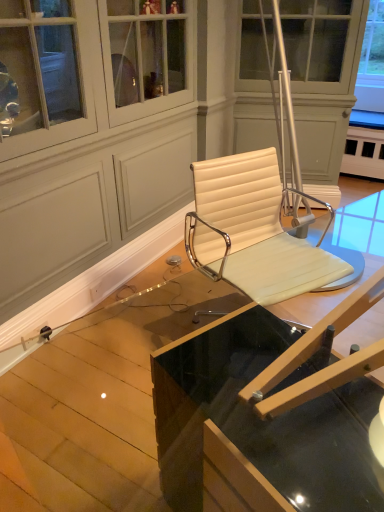
What do you see at coordinates (96, 399) in the screenshot?
I see `transparent glass table at center, the 2th table when ordered from front to back` at bounding box center [96, 399].

Describe the element at coordinates (268, 415) in the screenshot. I see `clear glass table at center, the second table viewed from the back` at that location.

This screenshot has width=384, height=512. I want to click on white leather chair at center, so click(x=251, y=231).

Is clear glass table at center, the 1th table viewed from the front, oriented towards transparent glass table at center, the 2th table when ordered from front to back?

Yes.

The height and width of the screenshot is (512, 384). I want to click on table behind the clear glass table at center, the 1th table viewed from the front, so click(96, 399).

Is clear glass table at center, the 1th table viewed from the front, to the right of transparent glass table at center, the 2th table when ordered from front to back, from the viewer's perspective?

Yes, clear glass table at center, the 1th table viewed from the front, is to the right of transparent glass table at center, the 2th table when ordered from front to back.

Which of these two, clear glass table at center, the 1th table viewed from the front, or transparent glass table at center, the 2th table when ordered from front to back, is thinner?

clear glass table at center, the 1th table viewed from the front.

From a real-world perspective, is white leather chair at center above or below transparent glass table at center, which is counted as the first table, starting from the back?

Clearly, from a real-world perspective, white leather chair at center is above transparent glass table at center, which is counted as the first table, starting from the back.

Is white leather chair at center directly adjacent to transparent glass table at center, which is counted as the first table, starting from the back?

No, white leather chair at center is not in contact with transparent glass table at center, which is counted as the first table, starting from the back.

In terms of size, does white leather chair at center appear bigger or smaller than transparent glass table at center, which is counted as the first table, starting from the back?

In the image, white leather chair at center appears to be smaller than transparent glass table at center, which is counted as the first table, starting from the back.

Does white leather chair at center touch clear glass table at center, the 1th table viewed from the front?

No, white leather chair at center is not making contact with clear glass table at center, the 1th table viewed from the front.

From the image's perspective, is white leather chair at center beneath clear glass table at center, the second table viewed from the back?

Incorrect, from the image's perspective, white leather chair at center is higher than clear glass table at center, the second table viewed from the back.

Considering the positions of point (326, 263) and point (296, 399), is point (326, 263) closer or farther from the camera than point (296, 399)?

Point (326, 263) is farther from the camera than point (296, 399).

Is the depth of white leather chair at center greater than that of clear glass table at center, the second table viewed from the back?

Yes, white leather chair at center is further from the camera.

Is transparent glass table at center, the 2th table when ordered from front to back, looking in the opposite direction of white leather chair at center?

No, white leather chair at center is not at the back of transparent glass table at center, the 2th table when ordered from front to back.

You are a GUI agent. You are given a task and a screenshot of the screen. Output one action in this format:
    pyautogui.click(x=<x>, y=<y>)
    Task: Click on the 1st table to the right of the white leather chair at center, starting your count from the anchor
    The width and height of the screenshot is (384, 512).
    Given the screenshot: What is the action you would take?
    pyautogui.click(x=96, y=399)

From the image's perspective, between transparent glass table at center, the 2th table when ordered from front to back, and white leather chair at center, who is located below?

transparent glass table at center, the 2th table when ordered from front to back, is shown below in the image.

Locate an element on the screen. table that is the 2nd object located below the white leather chair at center (from the image's perspective) is located at coordinates (268, 415).

Which of these two, clear glass table at center, the second table viewed from the back, or white leather chair at center, is smaller?

white leather chair at center is smaller.

From the image's perspective, is clear glass table at center, the second table viewed from the back, under white leather chair at center?

Indeed, from the image's perspective, clear glass table at center, the second table viewed from the back, is shown beneath white leather chair at center.

Between transparent glass table at center, which is counted as the first table, starting from the back, and clear glass table at center, the second table viewed from the back, which one has larger width?

transparent glass table at center, which is counted as the first table, starting from the back.

Does point (39, 385) come in front of point (164, 386)?

No, (39, 385) is further to viewer.

Is transparent glass table at center, the 2th table when ordered from front to back, not near clear glass table at center, the second table viewed from the back?

Actually, transparent glass table at center, the 2th table when ordered from front to back, and clear glass table at center, the second table viewed from the back, are a little close together.

Considering the relative positions of transparent glass table at center, which is counted as the first table, starting from the back, and clear glass table at center, the second table viewed from the back, in the image provided, is transparent glass table at center, which is counted as the first table, starting from the back, to the left of clear glass table at center, the second table viewed from the back, from the viewer's perspective?

Correct, you'll find transparent glass table at center, which is counted as the first table, starting from the back, to the left of clear glass table at center, the second table viewed from the back.

You are a GUI agent. You are given a task and a screenshot of the screen. Output one action in this format:
    pyautogui.click(x=<x>, y=<y>)
    Task: Click on the table below the transparent glass table at center, the 2th table when ordered from front to back (from the image's perspective)
    The image size is (384, 512).
    Given the screenshot: What is the action you would take?
    pyautogui.click(x=268, y=415)

Find the location of `the 2nd table directly beneath the white leather chair at center (from a real-world perspective)`. the 2nd table directly beneath the white leather chair at center (from a real-world perspective) is located at coordinates (96, 399).

When comparing their distances from clear glass table at center, the second table viewed from the back, does transparent glass table at center, the 2th table when ordered from front to back, or white leather chair at center seem further?

Based on the image, white leather chair at center appears to be further to clear glass table at center, the second table viewed from the back.

When comparing their distances from white leather chair at center, does clear glass table at center, the second table viewed from the back, or transparent glass table at center, the 2th table when ordered from front to back, seem closer?

transparent glass table at center, the 2th table when ordered from front to back, is positioned closer to the anchor white leather chair at center.

Considering their positions, is transparent glass table at center, the 2th table when ordered from front to back, positioned closer to white leather chair at center than clear glass table at center, the 1th table viewed from the front?

transparent glass table at center, the 2th table when ordered from front to back.

When comparing their distances from transparent glass table at center, the 2th table when ordered from front to back, does white leather chair at center or clear glass table at center, the 1th table viewed from the front, seem closer?

Based on the image, white leather chair at center appears to be nearer to transparent glass table at center, the 2th table when ordered from front to back.

From the image, which object appears to be farther from transparent glass table at center, which is counted as the first table, starting from the back, clear glass table at center, the 1th table viewed from the front, or white leather chair at center?

Based on the image, clear glass table at center, the 1th table viewed from the front, appears to be further to transparent glass table at center, which is counted as the first table, starting from the back.

Which object lies nearer to the anchor point clear glass table at center, the second table viewed from the back, white leather chair at center or transparent glass table at center, the 2th table when ordered from front to back?

The object closer to clear glass table at center, the second table viewed from the back, is transparent glass table at center, the 2th table when ordered from front to back.

Where is `table positioned between clear glass table at center, the 1th table viewed from the front, and white leather chair at center from near to far`? This screenshot has width=384, height=512. table positioned between clear glass table at center, the 1th table viewed from the front, and white leather chair at center from near to far is located at coordinates (96, 399).